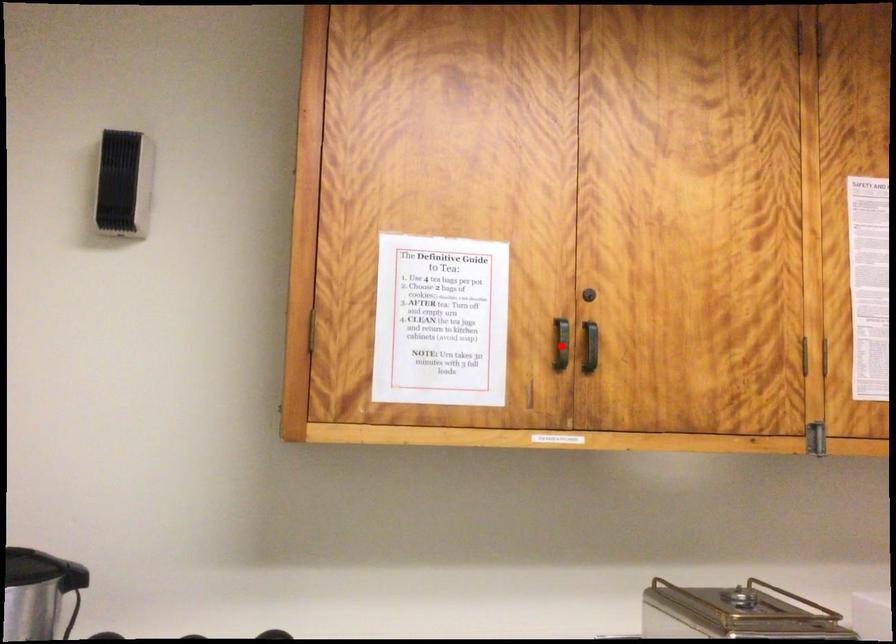
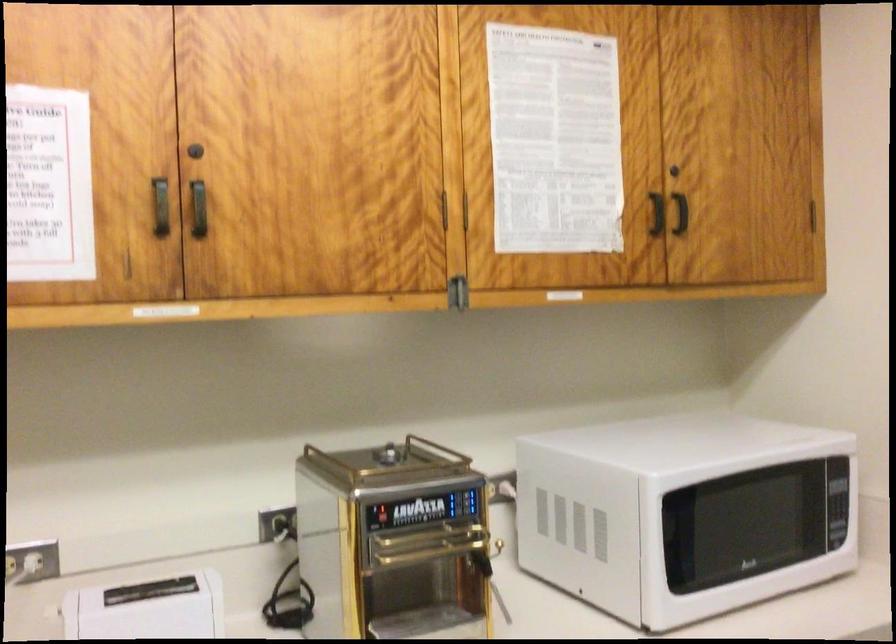
Question: I am providing you with two images of the same scene from different viewpoints. Image1 has a red point marked. In image2, the corresponding 3D location appears at what relative position? Reply with the corresponding letter.

Choices:
 (A) Closer
 (B) Farther

Answer: (A)